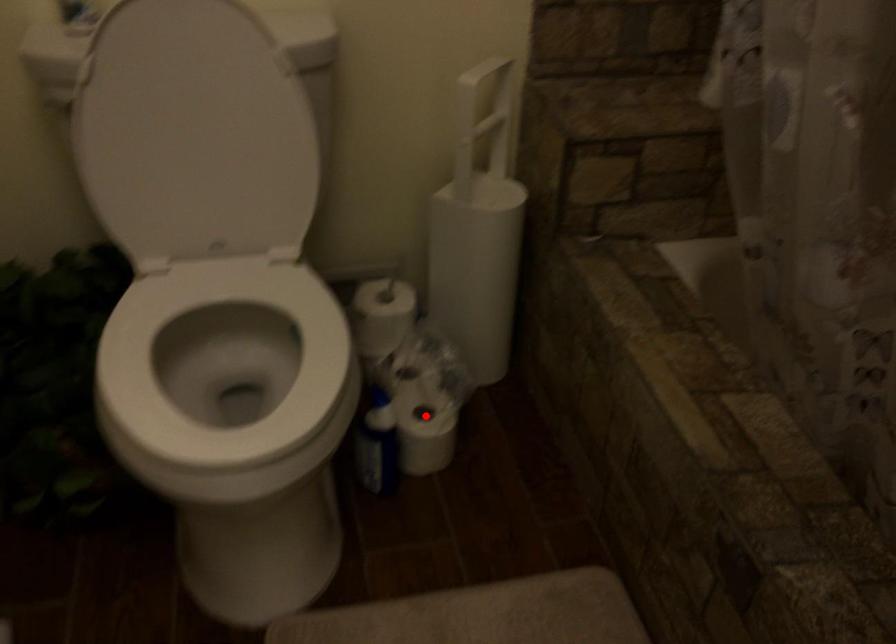
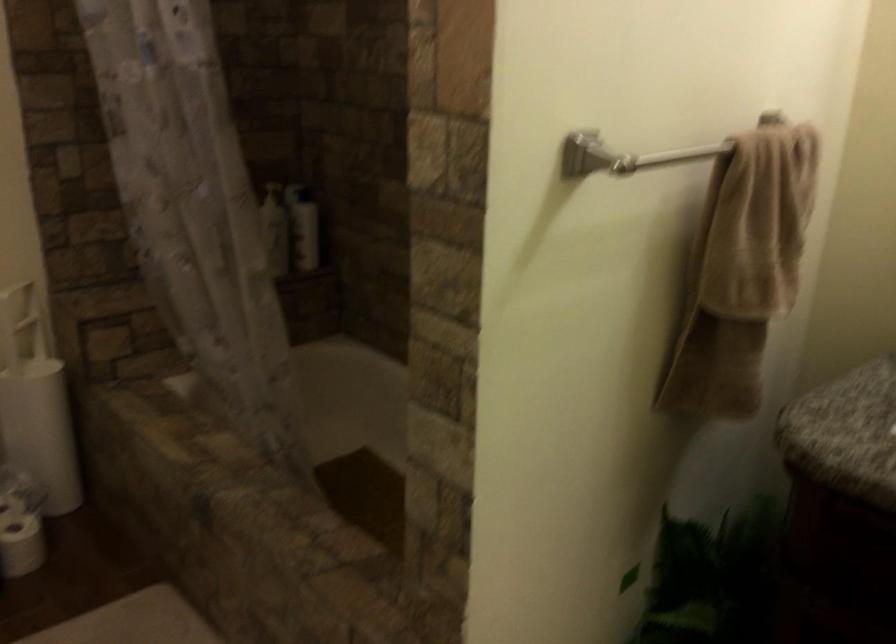
In the second image, find the point that corresponds to the highlighted location in the first image.

(20, 524)